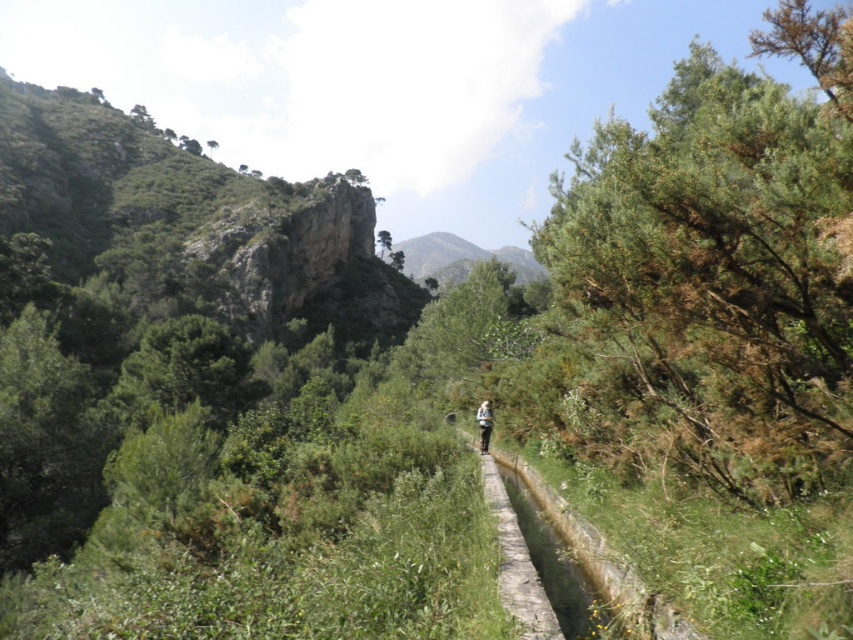
You are a hiker carrying a light brown fabric backpack at center and want to take a photo of the green leafy tree at right. To ensure both are in the frame, should you move closer to the backpack or the tree?

The green leafy tree at right might be wider than the light brown fabric backpack at center. To ensure both are in the frame, you should move closer to the tree so that the tree doesn

You are standing at the starting point of the pathway and want to reach a destination located at point (488, 435). There is another point at (103, 243) along the way. Which point should you pass first?

You should pass point (103, 243) first because it is closer to your starting position than point (488, 435).

You are a hiker planning to walk from the rocky cliff at upper left to the green leafy tree at right. The path between them is 105.99 meters. If your average walking speed is 1.5 meters per second, how many seconds will it take you to reach the tree?

The distance between the rocky cliff at upper left and the green leafy tree at right is 105.99 meters. At a speed of 1.5 meters per second, dividing the distance by the speed gives 105.99 divided by 1.5 equals approximately 70.66 seconds. So, it will take roughly 71 seconds to reach the tree.